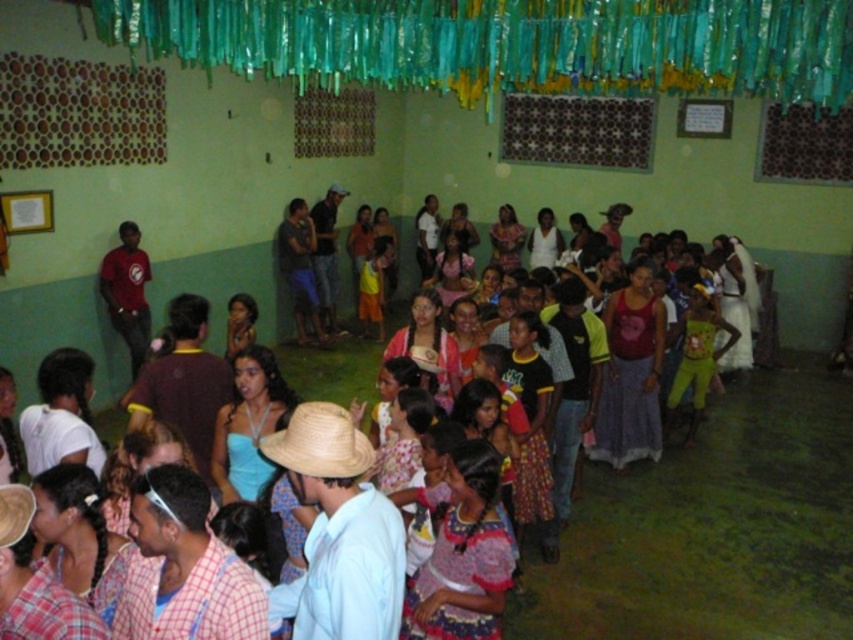
You are standing at the entrance of the room and see the printed cotton dress at center and the straw hat at center. If you want to pick up both items, which one should you reach for first if you can only move forward in a straight line?

The printed cotton dress at center is 38.37 inches away from the straw hat at center. Since both items are at the center, you would need to decide based on their exact positions, but the description only provides the distance between them, not their individual distances from you. Therefore, it is unclear which one is closer without additional information.